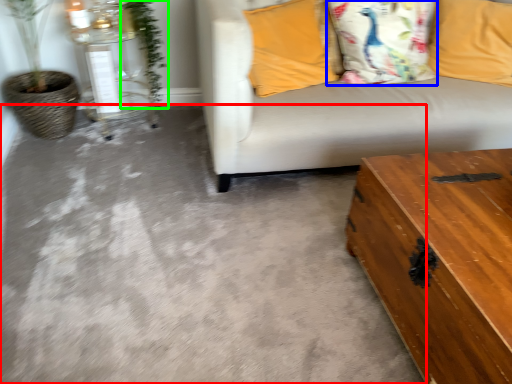
Question: Which is farther away from concrete (highlighted by a red box)? pillow (highlighted by a blue box) or plant (highlighted by a green box)?

Choices:
 (A) pillow
 (B) plant

Answer: (B)